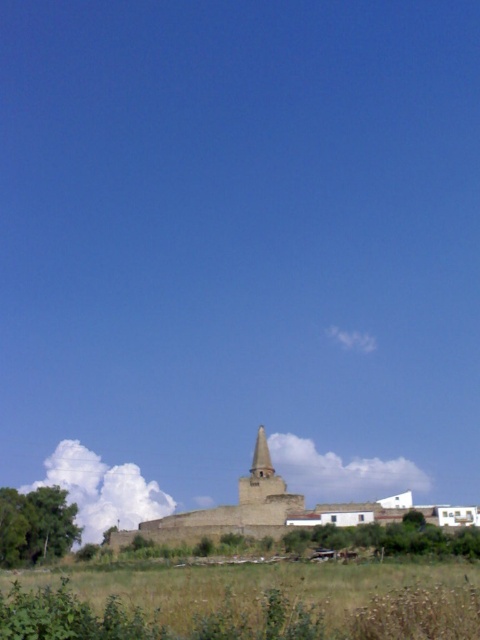
Question: In this image, where is green grassy field at lower center located relative to smooth stone tower at center?

Choices:
 (A) right
 (B) left

Answer: (A)

Question: Where is green grassy field at lower center located in relation to smooth stone tower at center in the image?

Choices:
 (A) left
 (B) right

Answer: (B)

Question: Can you confirm if green grassy field at lower center is wider than smooth stone tower at center?

Choices:
 (A) no
 (B) yes

Answer: (B)

Question: Which object is farther from the camera taking this photo?

Choices:
 (A) green grassy field at lower center
 (B) smooth stone tower at center

Answer: (B)

Question: Which point is closer to the camera?

Choices:
 (A) (439, 632)
 (B) (259, 490)

Answer: (A)